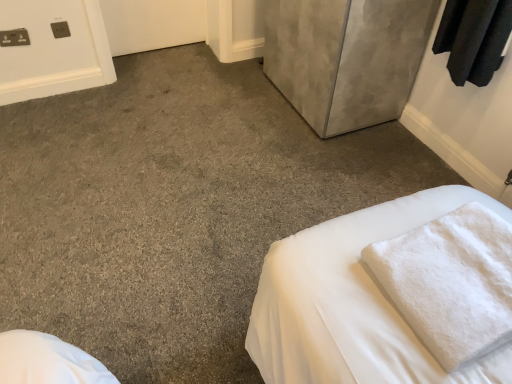
Question: Can you confirm if matte gray cabinet at upper right is bigger than white fluffy bath towel at lower right?

Choices:
 (A) yes
 (B) no

Answer: (A)

Question: From the image's perspective, is matte gray cabinet at upper right on top of white fluffy bath towel at lower right?

Choices:
 (A) no
 (B) yes

Answer: (B)

Question: Considering the relative sizes of matte gray cabinet at upper right and white fluffy bath towel at lower right in the image provided, is matte gray cabinet at upper right taller than white fluffy bath towel at lower right?

Choices:
 (A) no
 (B) yes

Answer: (B)

Question: Does matte gray cabinet at upper right have a greater width compared to white fluffy bath towel at lower right?

Choices:
 (A) no
 (B) yes

Answer: (B)

Question: From a real-world perspective, does matte gray cabinet at upper right sit lower than white fluffy bath towel at lower right?

Choices:
 (A) yes
 (B) no

Answer: (A)

Question: Does matte gray cabinet at upper right appear on the right side of white fluffy bath towel at lower right?

Choices:
 (A) yes
 (B) no

Answer: (B)

Question: Is white fluffy bath towel at lower right to the right of matte gray cabinet at upper right from the viewer's perspective?

Choices:
 (A) no
 (B) yes

Answer: (B)

Question: Considering the relative sizes of white fluffy bath towel at lower right and matte gray cabinet at upper right in the image provided, is white fluffy bath towel at lower right wider than matte gray cabinet at upper right?

Choices:
 (A) yes
 (B) no

Answer: (B)

Question: Does white fluffy bath towel at lower right turn towards matte gray cabinet at upper right?

Choices:
 (A) no
 (B) yes

Answer: (B)

Question: Is white fluffy bath towel at lower right not within matte gray cabinet at upper right?

Choices:
 (A) yes
 (B) no

Answer: (A)

Question: Are white fluffy bath towel at lower right and matte gray cabinet at upper right located far from each other?

Choices:
 (A) yes
 (B) no

Answer: (A)

Question: From a real-world perspective, is white fluffy bath towel at lower right under matte gray cabinet at upper right?

Choices:
 (A) no
 (B) yes

Answer: (A)

Question: Considering the positions of white fluffy bath towel at lower right and matte gray cabinet at upper right in the image, is white fluffy bath towel at lower right wider or thinner than matte gray cabinet at upper right?

Choices:
 (A) thin
 (B) wide

Answer: (A)